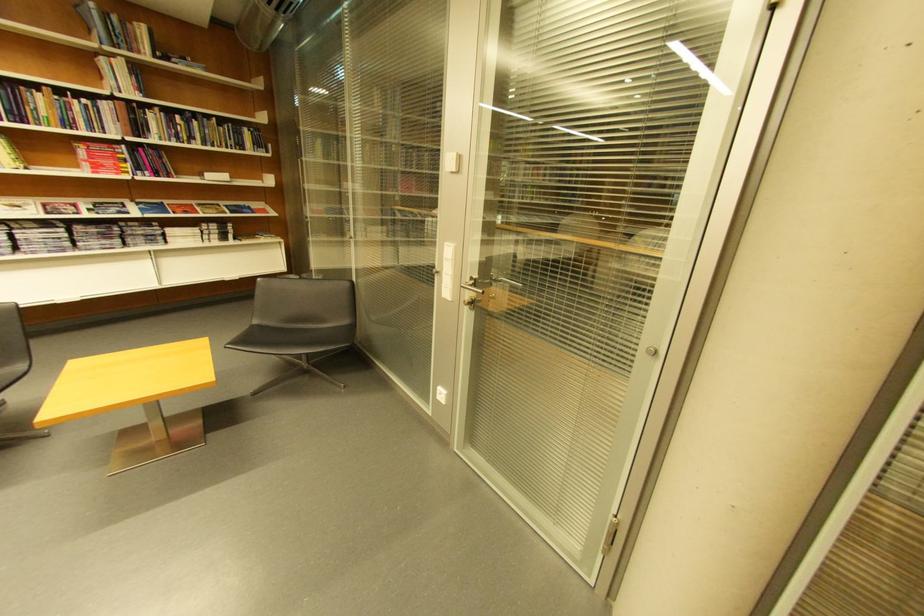
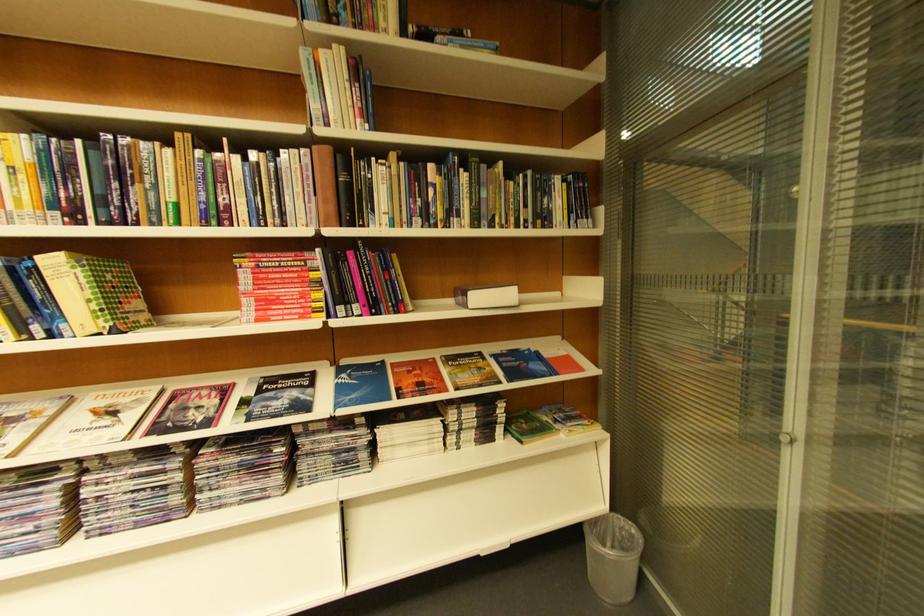
Find the pixel in the second image that matches the point at 251,148 in the first image.

(554, 221)